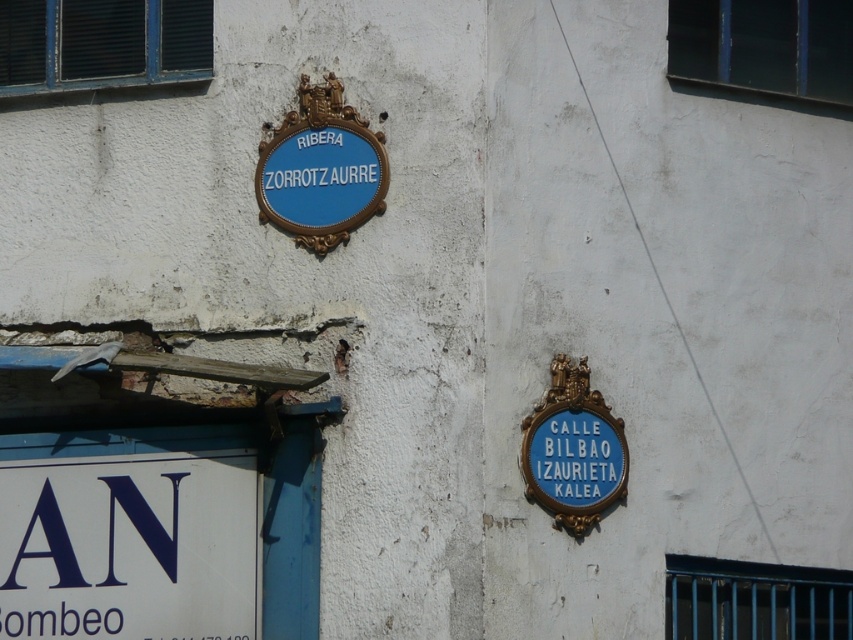
You are standing in front of the wall with the two signs. Which sign is closer to you, the white plastic sign at lower left or the blue painted wood sign at right?

The white plastic sign at lower left is closer to you because the blue painted wood sign at right is behind it.

You are standing in front of the wall with the two blue signs. There are two points marked on the wall at coordinates point (x=91, y=516) and point (x=583, y=468). If you want to touch the point that is closer to you, which coordinate should you reach for?

You should reach for point (x=91, y=516) because it is closer to you than point (x=583, y=468).